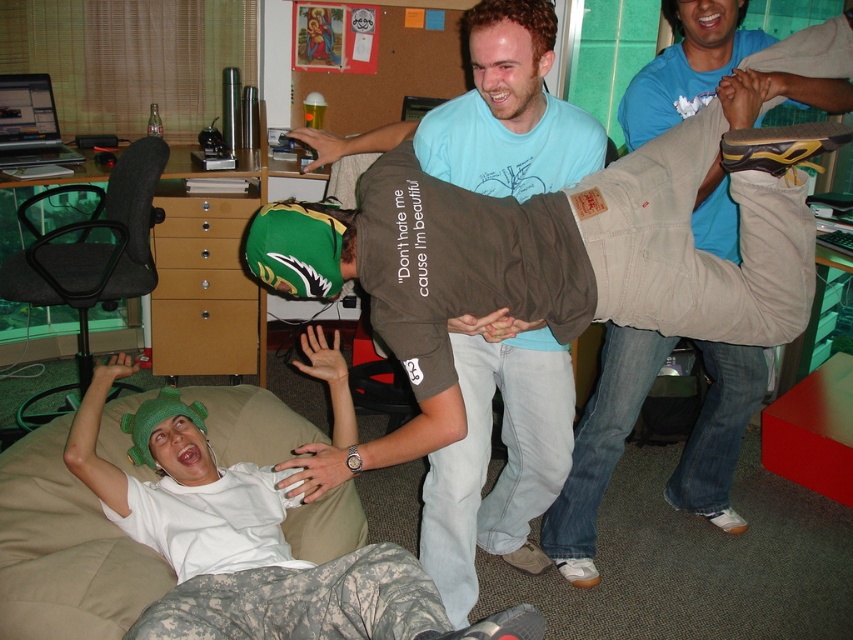
Can you confirm if khaki cotton pants at center is positioned above beige fabric couch at lower left?

Indeed, khaki cotton pants at center is positioned over beige fabric couch at lower left.

Is point (717, 349) less distant than point (68, 544)?

No, it is behind (68, 544).

Is point (659, 118) positioned before point (1, 627)?

No, (659, 118) is further to viewer.

You are a GUI agent. You are given a task and a screenshot of the screen. Output one action in this format:
    pyautogui.click(x=<x>, y=<y>)
    Task: Click on the khaki cotton pants at center
    The height and width of the screenshot is (640, 853).
    Given the screenshot: What is the action you would take?
    pyautogui.click(x=601, y=448)

Is beige fabric couch at lower left to the right of dark gray fabric bean bag chair at left from the viewer's perspective?

Yes, beige fabric couch at lower left is to the right of dark gray fabric bean bag chair at left.

At what (x,y) coordinates should I click in order to perform the action: click on beige fabric couch at lower left. Please return your answer as a coordinate pair (x, y). The image size is (853, 640). Looking at the image, I should click on (65, 550).

In the scene shown: Who is more forward, (114, 572) or (24, 202)?

Point (114, 572) is in front.

The width and height of the screenshot is (853, 640). Find the location of `beige fabric couch at lower left`. beige fabric couch at lower left is located at coordinates (65, 550).

From the picture: Can you confirm if khaki cotton pants at center is smaller than dark gray fabric bean bag chair at left?

Indeed, khaki cotton pants at center has a smaller size compared to dark gray fabric bean bag chair at left.

Locate an element on the screen. The width and height of the screenshot is (853, 640). khaki cotton pants at center is located at coordinates (601, 448).